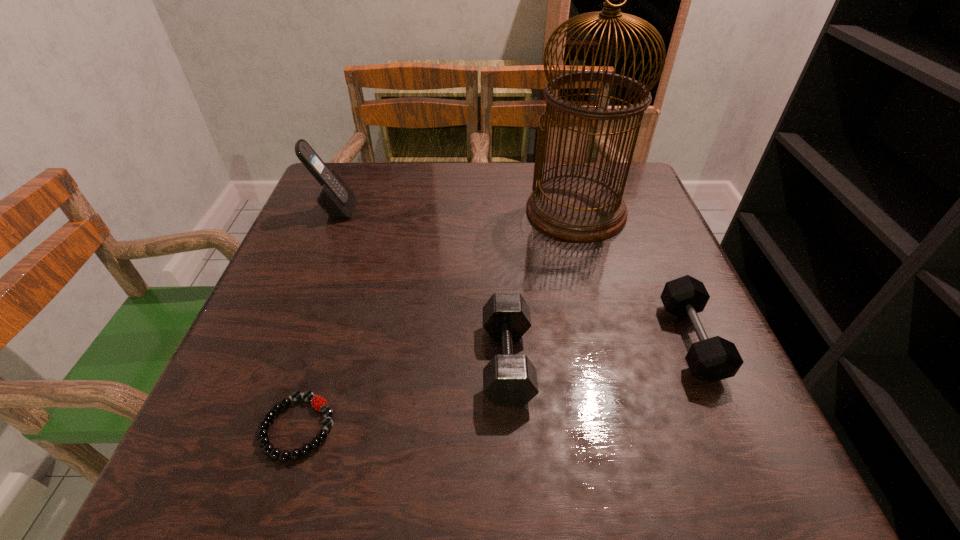
Locate an element on the screen. The image size is (960, 540). birdcage is located at coordinates (578, 207).

At what (x,y) coordinates should I click in order to perform the action: click on cellular telephone. Please return your answer as a coordinate pair (x, y). Looking at the image, I should click on (335, 197).

I want to click on the third object from left to right, so click(509, 379).

You are a GUI agent. You are given a task and a screenshot of the screen. Output one action in this format:
    pyautogui.click(x=<x>, y=<y>)
    Task: Click on the right dumbbell
    This screenshot has height=540, width=960.
    Given the screenshot: What is the action you would take?
    pyautogui.click(x=712, y=359)

Where is `the shortest object`? This screenshot has height=540, width=960. the shortest object is located at coordinates (318, 402).

You are a GUI agent. You are given a task and a screenshot of the screen. Output one action in this format:
    pyautogui.click(x=<x>, y=<y>)
    Task: Click on the vacant space positioned 0.080m on the front-facing side of the tallest object
    
    Given the screenshot: What is the action you would take?
    pyautogui.click(x=590, y=267)

In order to click on free location located on the front-facing side of the cellular telephone in this screenshot , I will do `click(478, 210)`.

Identify the location of vacant space positioned 0.300m on the right of the third object from right to left. This screenshot has width=960, height=540. (708, 361).

The image size is (960, 540). I want to click on free space located 0.150m on the back of the right dumbbell, so click(653, 251).

Where is `blank space located on the right of the shortest object`? This screenshot has height=540, width=960. blank space located on the right of the shortest object is located at coordinates (586, 428).